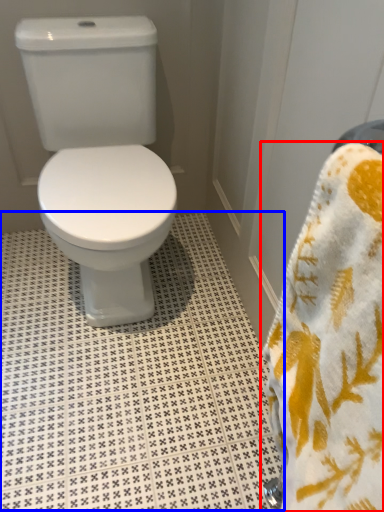
Question: Among these objects, which one is farthest to the camera, towel (highlighted by a red box) or tile (highlighted by a blue box)?

Choices:
 (A) towel
 (B) tile

Answer: (B)